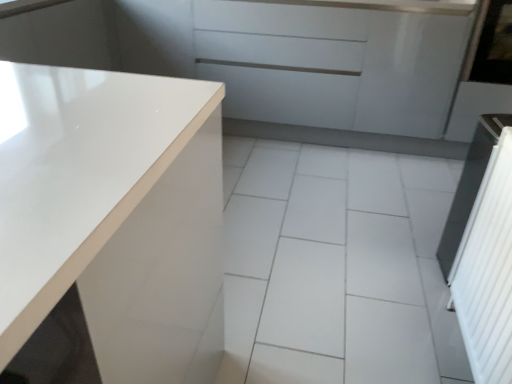
Describe the element at coordinates (114, 216) in the screenshot. I see `white glossy countertop at left` at that location.

Locate an element on the screen. white glossy countertop at left is located at coordinates (114, 216).

The height and width of the screenshot is (384, 512). Describe the element at coordinates (332, 65) in the screenshot. I see `glossy white cabinet at upper center` at that location.

The width and height of the screenshot is (512, 384). In order to click on transparent glass window screen at upper right in this screenshot , I will do `click(494, 46)`.

Identify the location of white glossy tile at center. (336, 266).

How much space does glossy white screen door at right, acting as the first screen door starting from the back, occupy vertically?

36.84 inches.

What do you see at coordinates (480, 78) in the screenshot?
I see `glossy white screen door at right, the second screen door from the bottom` at bounding box center [480, 78].

Image resolution: width=512 pixels, height=384 pixels. Identify the location of white textured screen door at right, the first screen door viewed from the left. (488, 271).

Locate an element on the screen. window screen behind the glossy white screen door at right, arranged as the first screen door when viewed from the right is located at coordinates (494, 46).

From the image's perspective, is glossy white screen door at right, arranged as the first screen door when viewed from the right, above or below transparent glass window screen at upper right?

From the image's perspective, glossy white screen door at right, arranged as the first screen door when viewed from the right, appears below transparent glass window screen at upper right.

From a real-world perspective, does glossy white screen door at right, which is counted as the second screen door, starting from the left, stand above transparent glass window screen at upper right?

No, from a real-world perspective, glossy white screen door at right, which is counted as the second screen door, starting from the left, is not on top of transparent glass window screen at upper right.

In terms of width, does glossy white cabinet at upper center look wider or thinner when compared to transparent glass window screen at upper right?

Considering their sizes, glossy white cabinet at upper center looks slimmer than transparent glass window screen at upper right.

Is point (400, 21) positioned before point (476, 75)?

That is True.

Identify the location of window screen that appears in front of the glossy white cabinet at upper center. (494, 46).

Can you confirm if white textured screen door at right, the 2th screen door when ordered from top to bottom, is smaller than glossy white cabinet at upper center?

Correct, white textured screen door at right, the 2th screen door when ordered from top to bottom, occupies less space than glossy white cabinet at upper center.

Based on the photo, is glossy white cabinet at upper center at the back of white textured screen door at right, arranged as the 2th screen door when viewed from the back?

white textured screen door at right, arranged as the 2th screen door when viewed from the back, is not turned away from glossy white cabinet at upper center.

From a real-world perspective, is white textured screen door at right, the 2th screen door when ordered from top to bottom, located beneath glossy white cabinet at upper center?

Yes, from a real-world perspective, white textured screen door at right, the 2th screen door when ordered from top to bottom, is beneath glossy white cabinet at upper center.

Is glossy white screen door at right, the 2th screen door when ordered from front to back, positioned beyond the bounds of white glossy countertop at left?

Yes, glossy white screen door at right, the 2th screen door when ordered from front to back, is located beyond the bounds of white glossy countertop at left.

Is glossy white screen door at right, acting as the first screen door starting from the back, smaller than white glossy countertop at left?

Correct, glossy white screen door at right, acting as the first screen door starting from the back, occupies less space than white glossy countertop at left.

Who is taller, glossy white screen door at right, acting as the first screen door starting from the back, or white glossy countertop at left?

With more height is glossy white screen door at right, acting as the first screen door starting from the back.

Is glossy white screen door at right, placed as the 1th screen door when sorted from top to bottom, facing towards white glossy countertop at left?

No, glossy white screen door at right, placed as the 1th screen door when sorted from top to bottom, is not turned towards white glossy countertop at left.

Can you tell me how much glossy white screen door at right, acting as the first screen door starting from the back, and white glossy tile at center differ in facing direction?

The angle between the facing direction of glossy white screen door at right, acting as the first screen door starting from the back, and the facing direction of white glossy tile at center is 90.4 degrees.

Is glossy white screen door at right, placed as the 1th screen door when sorted from top to bottom, bigger than white glossy tile at center?

Indeed, glossy white screen door at right, placed as the 1th screen door when sorted from top to bottom, has a larger size compared to white glossy tile at center.

Based on the photo, between glossy white screen door at right, the 2th screen door when ordered from front to back, and white glossy tile at center, which one has smaller width?

Thinner between the two is glossy white screen door at right, the 2th screen door when ordered from front to back.

Considering the positions of objects glossy white screen door at right, which is counted as the second screen door, starting from the left, and white glossy tile at center in the image provided, who is more to the left, glossy white screen door at right, which is counted as the second screen door, starting from the left, or white glossy tile at center?

Positioned to the left is white glossy tile at center.

Where is `ceramic tile below the transparent glass window screen at upper right (from a real-world perspective)`? The height and width of the screenshot is (384, 512). ceramic tile below the transparent glass window screen at upper right (from a real-world perspective) is located at coordinates (336, 266).

Is white glossy tile at center surrounded by transparent glass window screen at upper right?

No, white glossy tile at center is not surrounded by transparent glass window screen at upper right.

Is white glossy tile at center at the back of transparent glass window screen at upper right?

transparent glass window screen at upper right is not turned away from white glossy tile at center.

Can you tell me how much transparent glass window screen at upper right and white glossy tile at center differ in facing direction?

89.2 degrees.

Who is bigger, white glossy tile at center or transparent glass window screen at upper right?

white glossy tile at center is bigger.

From the picture: Is white glossy tile at center facing towards transparent glass window screen at upper right?

No, white glossy tile at center is not oriented towards transparent glass window screen at upper right.

Which is closer, (x=351, y=174) or (x=506, y=60)?

Point (x=506, y=60)

At what (x,y) coordinates should I click in order to perform the action: click on the 1st screen door directly beneath the transparent glass window screen at upper right (from a real-world perspective). Please return your answer as a coordinate pair (x, y). The width and height of the screenshot is (512, 384). Looking at the image, I should click on (480, 78).

At what (x,y) coordinates should I click in order to perform the action: click on window screen in front of the glossy white cabinet at upper center. Please return your answer as a coordinate pair (x, y). Looking at the image, I should click on (494, 46).

Based on the photo, when comparing their distances from white textured screen door at right, which is the first screen door in front-to-back order, does glossy white screen door at right, placed as the 1th screen door when sorted from top to bottom, or white glossy tile at center seem closer?

Based on the image, white glossy tile at center appears to be nearer to white textured screen door at right, which is the first screen door in front-to-back order.

When comparing their distances from glossy white screen door at right, arranged as the first screen door when viewed from the right, does white textured screen door at right, the first screen door viewed from the left, or white glossy tile at center seem further?

white textured screen door at right, the first screen door viewed from the left, is further to glossy white screen door at right, arranged as the first screen door when viewed from the right.

Looking at the image, which one is located further to white textured screen door at right, which is the first screen door in front-to-back order, glossy white screen door at right, arranged as the first screen door when viewed from the right, or white glossy countertop at left?

Based on the image, glossy white screen door at right, arranged as the first screen door when viewed from the right, appears to be further to white textured screen door at right, which is the first screen door in front-to-back order.

Estimate the real-world distances between objects in this image. Which object is further from glossy white cabinet at upper center, transparent glass window screen at upper right or white glossy tile at center?

white glossy tile at center lies further to glossy white cabinet at upper center than the other object.

Which object lies nearer to the anchor point white textured screen door at right, the 2th screen door when ordered from top to bottom, transparent glass window screen at upper right or glossy white cabinet at upper center?

transparent glass window screen at upper right is positioned closer to the anchor white textured screen door at right, the 2th screen door when ordered from top to bottom.

Estimate the real-world distances between objects in this image. Which object is closer to transparent glass window screen at upper right, glossy white cabinet at upper center or glossy white screen door at right, which is counted as the second screen door, starting from the left?

glossy white screen door at right, which is counted as the second screen door, starting from the left.

When comparing their distances from white glossy tile at center, does transparent glass window screen at upper right or glossy white screen door at right, which is counted as the second screen door, starting from the left, seem closer?

glossy white screen door at right, which is counted as the second screen door, starting from the left, is closer to white glossy tile at center.

Estimate the real-world distances between objects in this image. Which object is further from transparent glass window screen at upper right, white textured screen door at right, arranged as the 2th screen door when viewed from the back, or glossy white screen door at right, arranged as the first screen door when viewed from the right?

white textured screen door at right, arranged as the 2th screen door when viewed from the back, lies further to transparent glass window screen at upper right than the other object.

Locate an element on the screen. The image size is (512, 384). screen door between white textured screen door at right, which is the first screen door in front-to-back order, and transparent glass window screen at upper right in the front-back direction is located at coordinates click(480, 78).

Find the location of `ceramic tile located between white glossy countertop at left and glossy white screen door at right, placed as the 1th screen door when sorted from top to bottom, in the left-right direction`. ceramic tile located between white glossy countertop at left and glossy white screen door at right, placed as the 1th screen door when sorted from top to bottom, in the left-right direction is located at coordinates (336, 266).

Where is `ceramic tile situated between white glossy countertop at left and white textured screen door at right, which is the first screen door in front-to-back order, from left to right`? ceramic tile situated between white glossy countertop at left and white textured screen door at right, which is the first screen door in front-to-back order, from left to right is located at coordinates (336, 266).

The image size is (512, 384). Identify the location of window screen between white glossy countertop at left and glossy white screen door at right, placed as the 1th screen door when sorted from top to bottom. pyautogui.click(x=494, y=46).